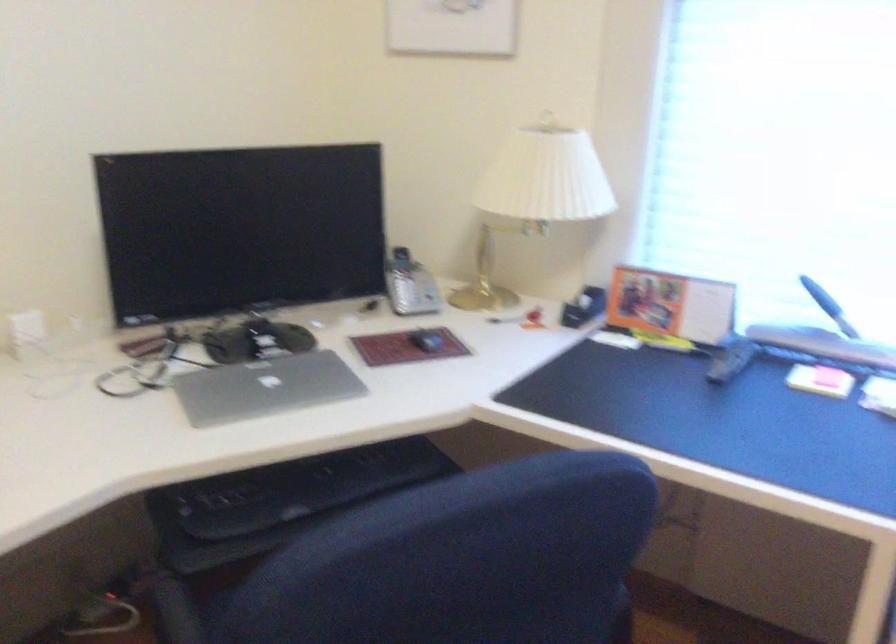
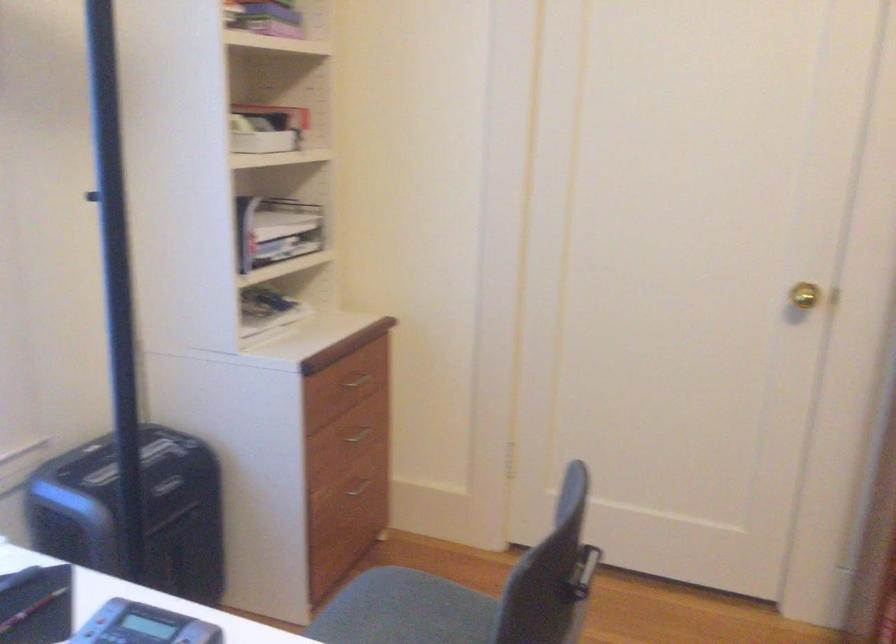
First-person continuous shooting, in which direction is the camera rotating?

The rotation direction of the camera is right-down.